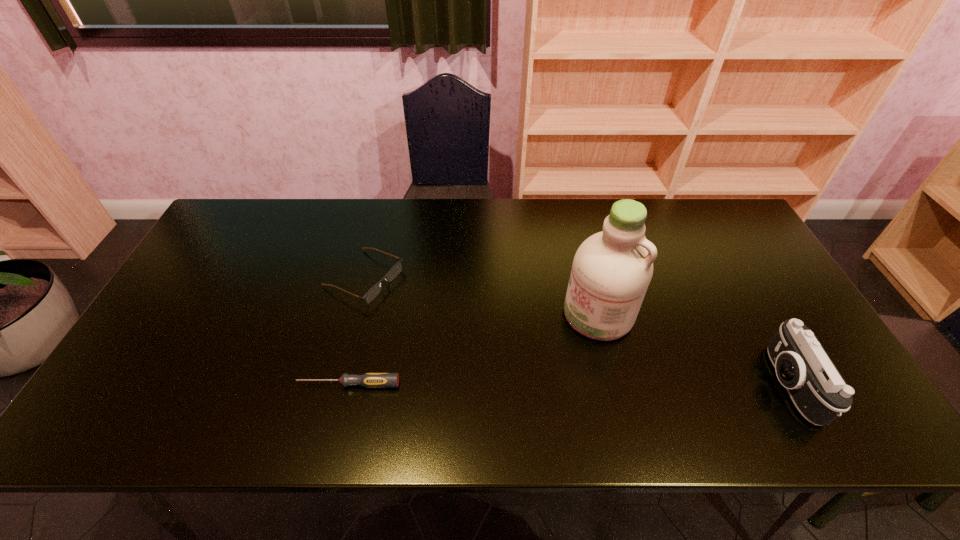
I want to click on screwdriver, so click(x=370, y=380).

You are a GUI agent. You are given a task and a screenshot of the screen. Output one action in this format:
    pyautogui.click(x=<x>, y=<y>)
    Task: Click on the second tallest object
    This screenshot has height=540, width=960.
    Given the screenshot: What is the action you would take?
    pyautogui.click(x=819, y=392)

The width and height of the screenshot is (960, 540). Find the location of `the rightmost object`. the rightmost object is located at coordinates (819, 392).

Image resolution: width=960 pixels, height=540 pixels. What are the coordinates of `spectacles` in the screenshot? It's located at (396, 269).

Identify the location of cleansing agent. (611, 271).

Where is `the tallest object`? This screenshot has height=540, width=960. the tallest object is located at coordinates (611, 271).

Locate an element on the screen. This screenshot has height=540, width=960. vacant space located insert the shortest object into a screw head is located at coordinates (134, 384).

The width and height of the screenshot is (960, 540). In order to click on free location located 0.380m insert the shortest object into a screw head in this screenshot , I will do `click(138, 384)`.

I want to click on vacant space situated 0.340m insert the shortest object into a screw head, so click(x=155, y=384).

Find the location of a particular element. free space located 0.280m on the front lens of the camera is located at coordinates (651, 384).